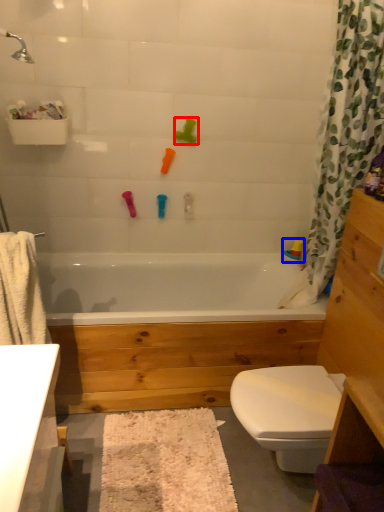
Question: Which object is closer to the camera taking this photo, toy (highlighted by a red box) or toy (highlighted by a blue box)?

Choices:
 (A) toy
 (B) toy

Answer: (A)